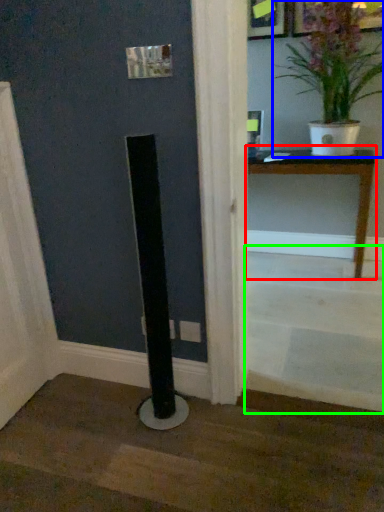
Question: Based on their relative distances, which object is nearer to table (highlighted by a red box)? Choose from houseplant (highlighted by a blue box) and stairwell (highlighted by a green box).

Choices:
 (A) houseplant
 (B) stairwell

Answer: (A)